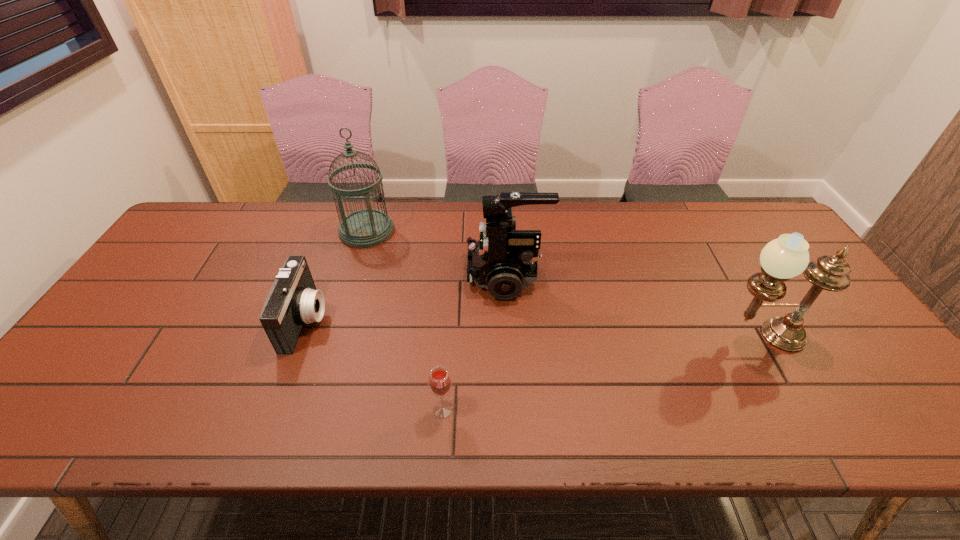
Locate an element on the screen. This screenshot has width=960, height=540. vacant space that is in between the rightmost object and the shorter camcorder is located at coordinates (533, 328).

You are a GUI agent. You are given a task and a screenshot of the screen. Output one action in this format:
    pyautogui.click(x=<x>, y=<y>)
    Task: Click on the vacant space that is in between the oil lamp and the left camcorder
    
    Given the screenshot: What is the action you would take?
    pyautogui.click(x=533, y=328)

The height and width of the screenshot is (540, 960). Identify the location of vacant space in between the birdcage and the second object from right to left. (437, 253).

Identify the location of object that ranks as the third closest to the second object from right to left. (293, 299).

Identify which object is the fourth nearest to the third object from right to left. Please provide its 2D coordinates. Your answer should be formatted as a tuple, i.e. [(x, y)], where the tuple contains the x and y coordinates of a point satisfying the conditions above.

[(787, 256)]

Identify the location of free space that satisfies the following two spatial constraints: 1. on the front-facing side of the rightmost object; 2. on the right side of the farthest object. The width and height of the screenshot is (960, 540). (335, 336).

Where is `vacant area in the image that satisfies the following two spatial constraints: 1. on the lens of the left camcorder; 2. on the back side of the rightmost object`? The image size is (960, 540). vacant area in the image that satisfies the following two spatial constraints: 1. on the lens of the left camcorder; 2. on the back side of the rightmost object is located at coordinates (300, 336).

I want to click on free space that satisfies the following two spatial constraints: 1. on the back side of the oil lamp; 2. on the lens mount of the taller camcorder, so click(727, 276).

Identify the location of vacant space that satisfies the following two spatial constraints: 1. on the lens of the left camcorder; 2. on the right side of the wineglass. Image resolution: width=960 pixels, height=540 pixels. (273, 409).

I want to click on free location that satisfies the following two spatial constraints: 1. on the lens of the shorter camcorder; 2. on the right side of the wineglass, so click(x=273, y=409).